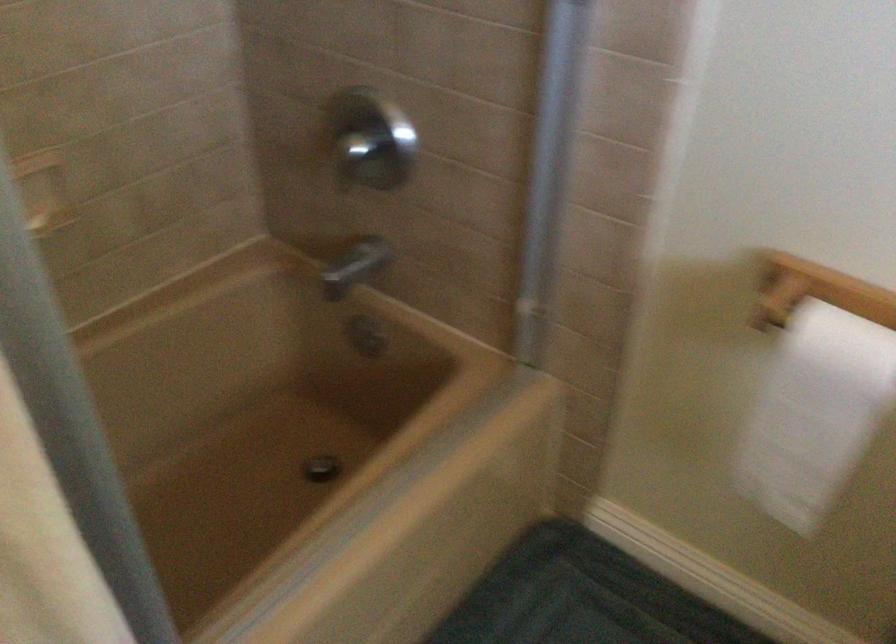
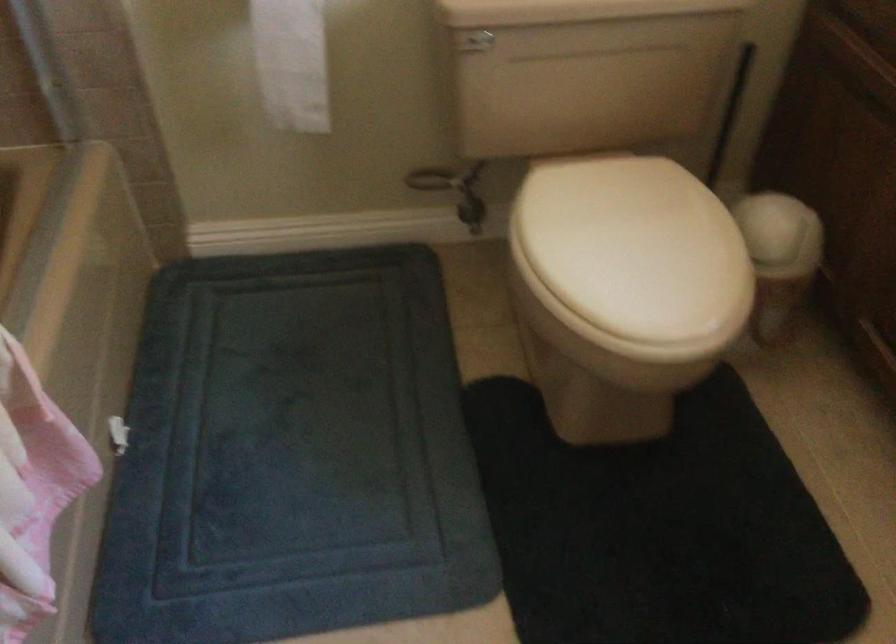
In the second image, find the point that corresponds to (799,438) in the first image.

(291, 62)